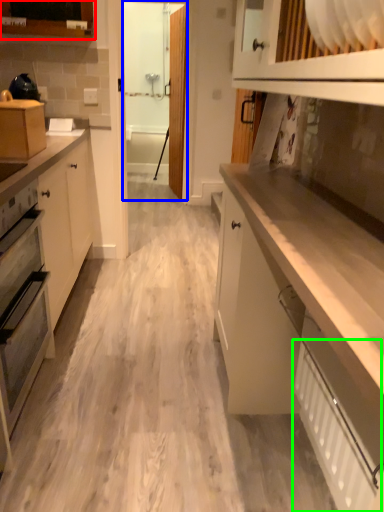
Question: Which object is positioned farthest from cabinetry (highlighted by a red box)? Select from glass door (highlighted by a blue box) and radiator (highlighted by a green box).

Choices:
 (A) glass door
 (B) radiator

Answer: (B)